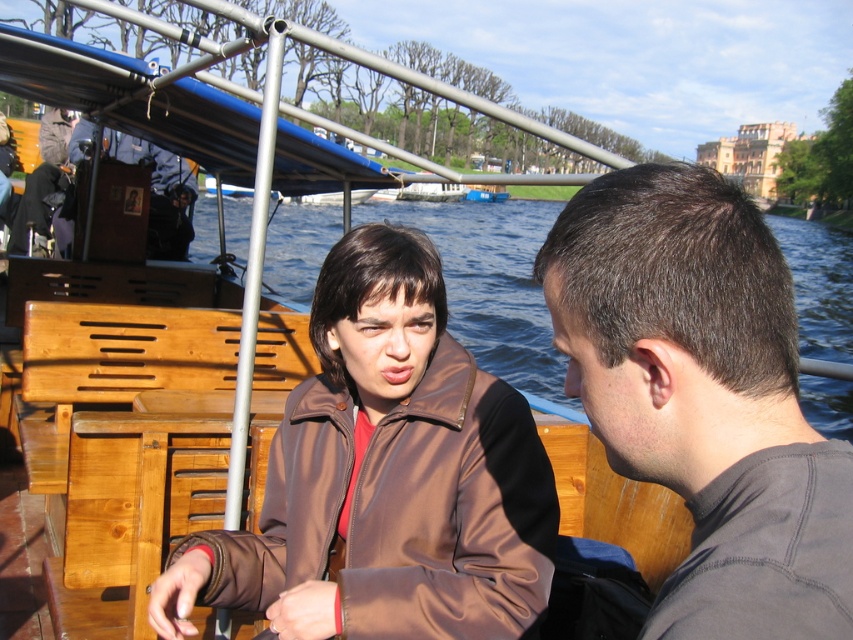
Question: Does brown satin jacket at center have a lesser width compared to dark brown hair at right?

Choices:
 (A) yes
 (B) no

Answer: (B)

Question: Is brown satin jacket at center to the left of dark brown hair at right from the viewer's perspective?

Choices:
 (A) no
 (B) yes

Answer: (B)

Question: Is the position of brown satin jacket at center more distant than that of dark brown hair at right?

Choices:
 (A) yes
 (B) no

Answer: (A)

Question: Among these objects, which one is nearest to the camera?

Choices:
 (A) dark brown hair at right
 (B) brown satin jacket at center

Answer: (A)